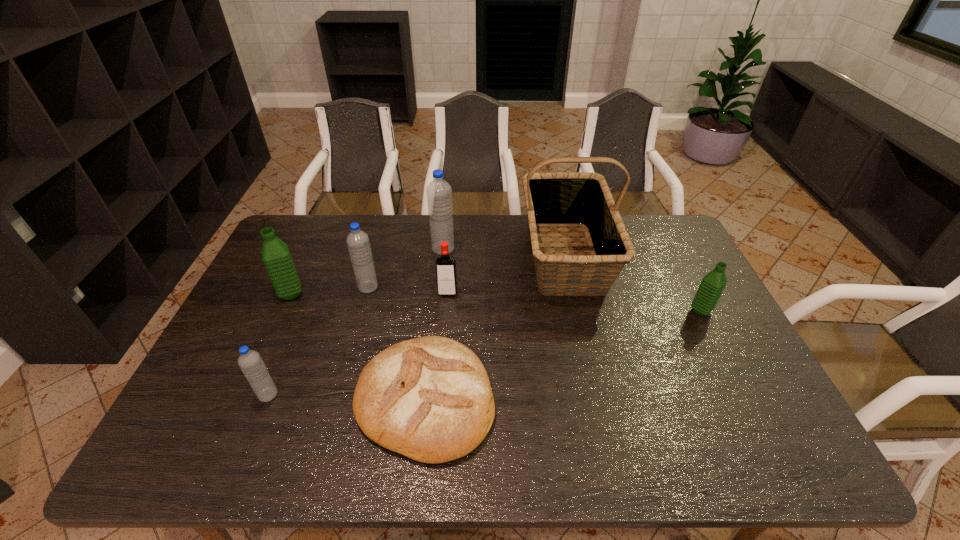
You are a GUI agent. You are given a task and a screenshot of the screen. Output one action in this format:
    pyautogui.click(x=<x>, y=<y>)
    Task: Click on the free space at the far right corner
    
    Given the screenshot: What is the action you would take?
    pyautogui.click(x=633, y=221)

Identify the location of vacant space that's between the seventh object from left to right and the bread. (495, 328).

I want to click on free point between the second blue water bottle from right to left and the seventh object from left to right, so click(x=467, y=272).

The height and width of the screenshot is (540, 960). Identify the location of empty location between the third object from left to right and the shortest object. (396, 343).

Where is `free space between the left green water bottle and the nearest water bottle`? Image resolution: width=960 pixels, height=540 pixels. free space between the left green water bottle and the nearest water bottle is located at coordinates (279, 345).

You are a GUI agent. You are given a task and a screenshot of the screen. Output one action in this format:
    pyautogui.click(x=<x>, y=<y>)
    Task: Click on the free area in between the seventh object from left to right and the red vodka
    Image resolution: width=960 pixels, height=540 pixels.
    Given the screenshot: What is the action you would take?
    pyautogui.click(x=507, y=274)

What are the coordinates of `free space between the right green water bottle and the vodka` in the screenshot? It's located at (574, 302).

At what (x,y) coordinates should I click in order to perform the action: click on empty space that is in between the second object from right to left and the vodka. Please return your answer as a coordinate pair (x, y). Looking at the image, I should click on (507, 274).

The width and height of the screenshot is (960, 540). Identify the location of vacant area that lies between the tallest object and the bigger green water bottle. (428, 275).

Find the location of `unoccupied area between the vodka and the second blue water bottle from right to left`. unoccupied area between the vodka and the second blue water bottle from right to left is located at coordinates click(408, 291).